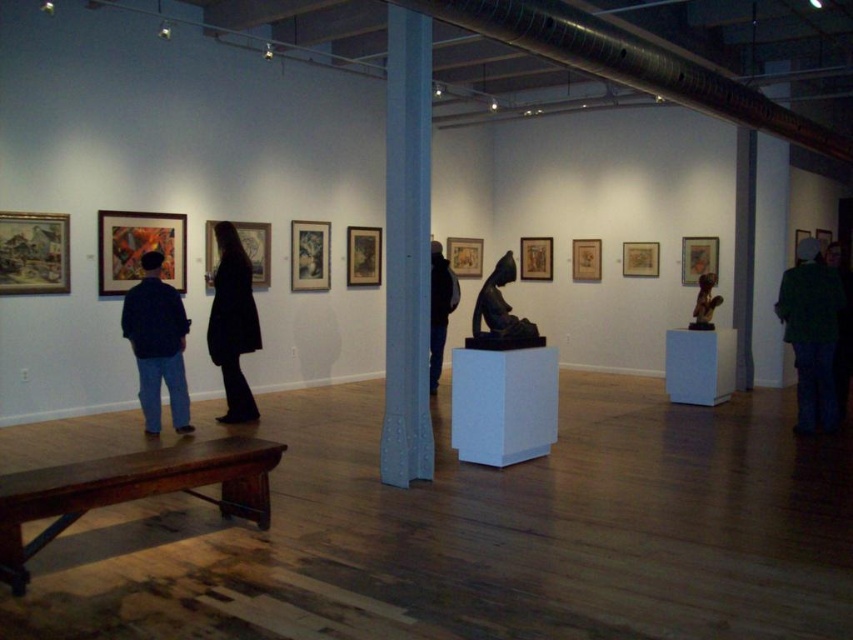
You are an art collector standing in the gallery and want to take a closer look at both the green fuzzy coat at right and the black matte jacket at center. Which one can you see more clearly without moving your position?

The green fuzzy coat at right is in front of the black matte jacket at center, so you can see the green fuzzy coat at right more clearly without moving your position.

You are an art gallery visitor who wants to take a photo of the black matte jacket at center without the green fuzzy coat at right appearing in the frame. Is this possible given their positions?

The green fuzzy coat at right is located below the black matte jacket at center, so you can position your camera to frame the black matte jacket at center while avoiding the lower area where the green fuzzy coat at right is situated.

You are an art curator planning to arrange two items in the gallery. You have the dark blue jeans at left and the bronze statue at center. If you want to place them side by side, which item requires more horizontal space?

The dark blue jeans at left requires more horizontal space because its width surpasses that of the bronze statue at center.